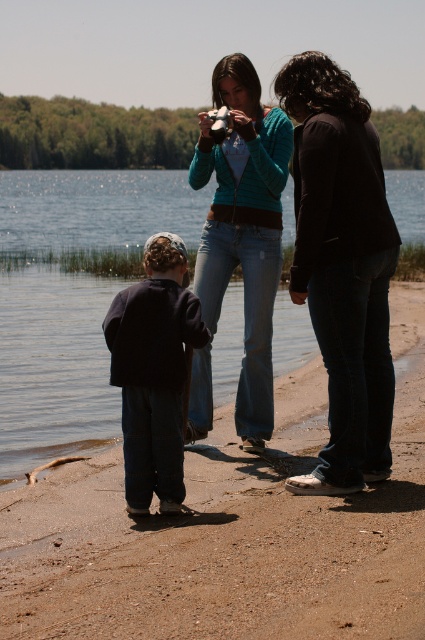
Does brown sandy beach at lower center appear on the right side of dark blue fabric at center?

No, brown sandy beach at lower center is not to the right of dark blue fabric at center.

Is brown sandy beach at lower center taller than dark blue fabric at center?

In fact, brown sandy beach at lower center may be shorter than dark blue fabric at center.

Locate an element on the screen. brown sandy beach at lower center is located at coordinates (231, 532).

Based on the photo, between black matte pants at right and jeans at center, which one is positioned higher?

jeans at center is above.

Identify the location of black matte pants at right. (342, 268).

Identify the location of black matte pants at right. (342, 268).

Is point (308, 516) positioned after point (359, 240)?

That is False.

Which is behind, point (214, 435) or point (303, 152)?

The point (214, 435) is behind.

The height and width of the screenshot is (640, 425). Identify the location of brown sandy beach at lower center. (231, 532).